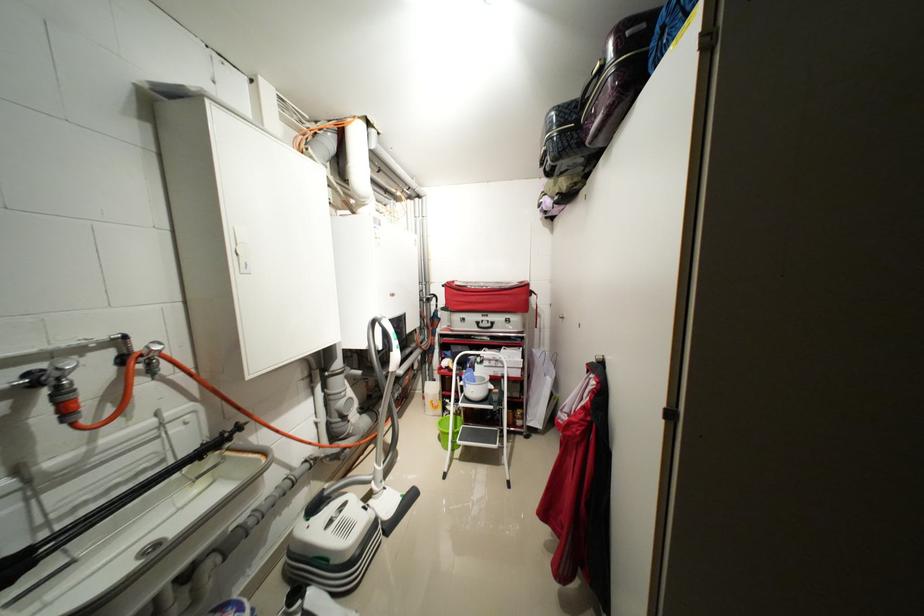
I want to click on vacuum cleaner handle, so click(383, 351).